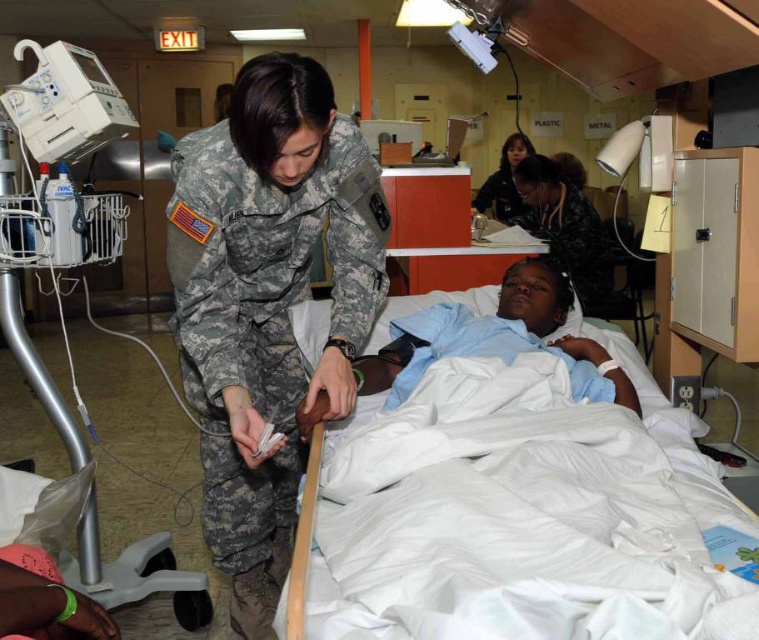
You are a medical technician in the field hospital. You need to place a new sensor at the point closer to you between point (216, 509) and point (175, 570). Which point should you choose?

Point (216, 509) is closer to the viewer than point (175, 570), so you should choose point (216, 509).

You are a nurse in the hospital. You need to move a medical kit from the camouflage fabric uniform at center to the white plastic medical cart at left. Considering their heights, will you have to bend down or reach up to place the kit on the cart?

The camouflage fabric uniform at center has a greater height compared to white plastic medical cart at left, so you will have to bend down to place the medical kit on the cart.